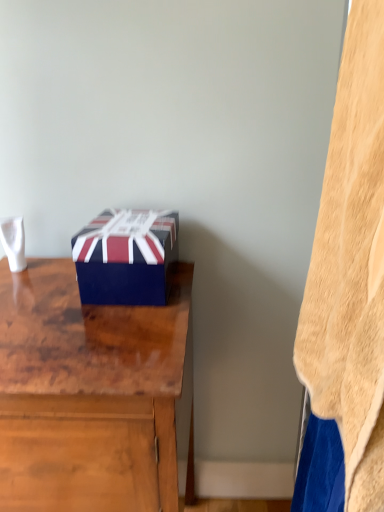
Question: Is point (344, 138) positioned closer to the camera than point (129, 298)?

Choices:
 (A) farther
 (B) closer

Answer: (B)

Question: Do you think beige fleece blanket at right is within blue glossy box at center, or outside of it?

Choices:
 (A) outside
 (B) inside

Answer: (A)

Question: Based on their relative distances, which object is farther from the blue glossy box at center?

Choices:
 (A) beige fleece blanket at right
 (B) wooden desk at center

Answer: (A)

Question: Which of these objects is positioned farthest from the beige fleece blanket at right?

Choices:
 (A) wooden desk at center
 (B) blue glossy box at center

Answer: (B)